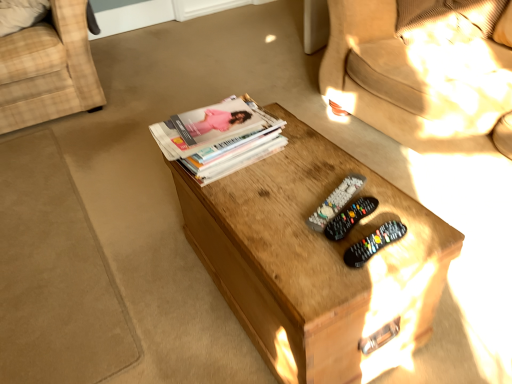
The width and height of the screenshot is (512, 384). Find the location of `free area behind black plastic remote control at center, marked as the second remote control in a back-to-front arrangement`. free area behind black plastic remote control at center, marked as the second remote control in a back-to-front arrangement is located at coordinates (324, 175).